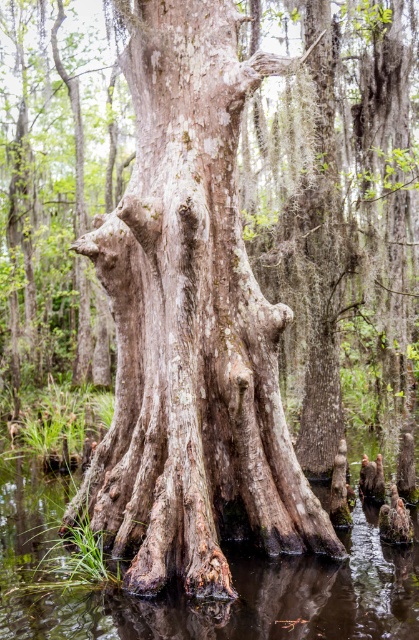
Question: Does smooth bark tree trunk at center appear on the right side of brown muddy water at lower center?

Choices:
 (A) yes
 (B) no

Answer: (B)

Question: Which object appears closest to the camera in this image?

Choices:
 (A) smooth bark tree trunk at center
 (B) brown muddy water at lower center

Answer: (B)

Question: Which point is closer to the camera?

Choices:
 (A) smooth bark tree trunk at center
 (B) brown muddy water at lower center

Answer: (B)

Question: Does smooth bark tree trunk at center have a smaller size compared to brown muddy water at lower center?

Choices:
 (A) no
 (B) yes

Answer: (A)

Question: Does smooth bark tree trunk at center have a lesser width compared to brown muddy water at lower center?

Choices:
 (A) no
 (B) yes

Answer: (A)